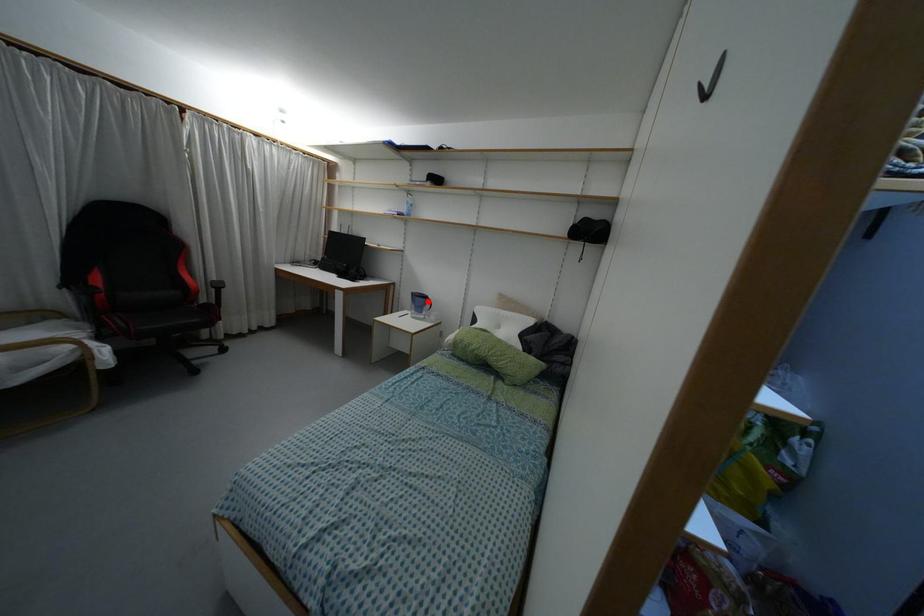
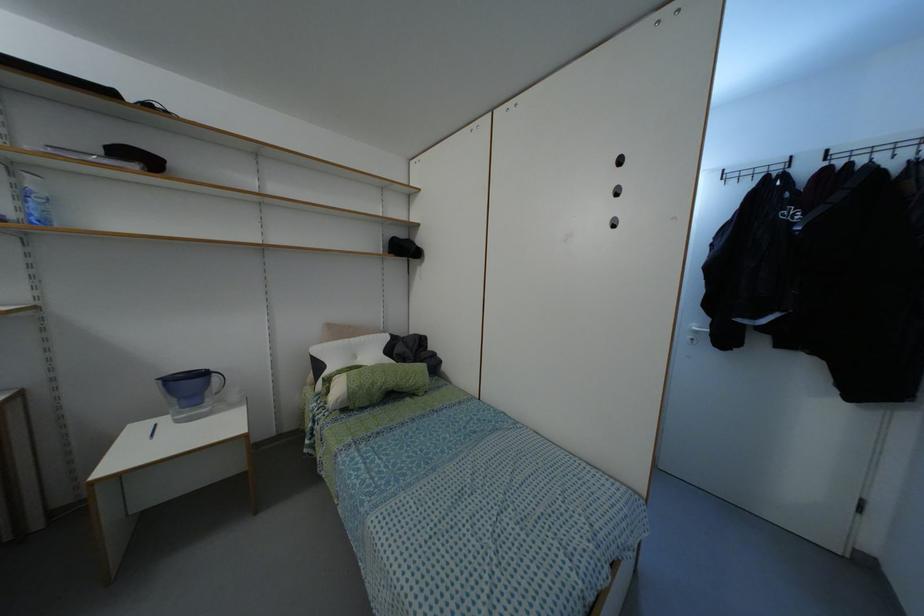
Where in the second image is the point corresponding to the highlighted location from the first image?

(214, 378)